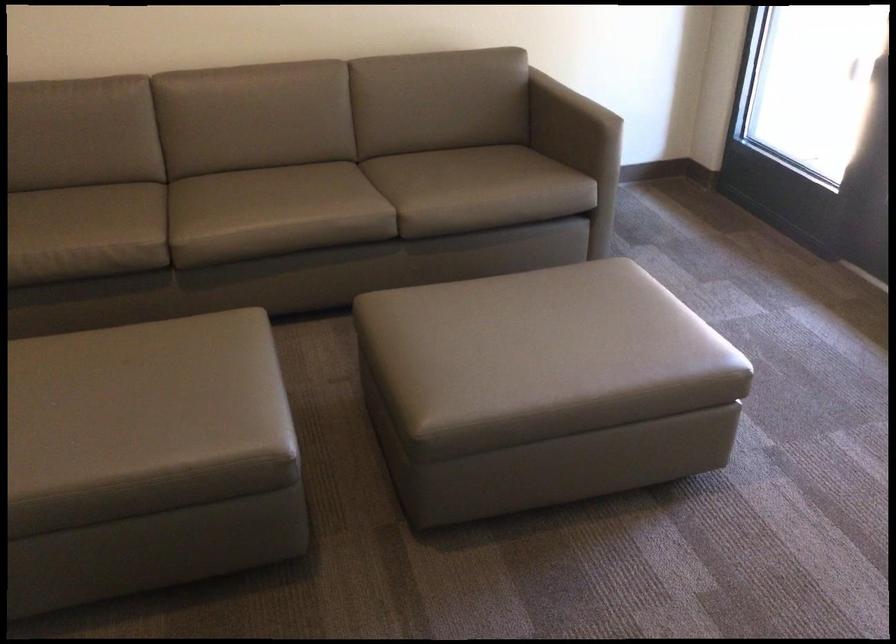
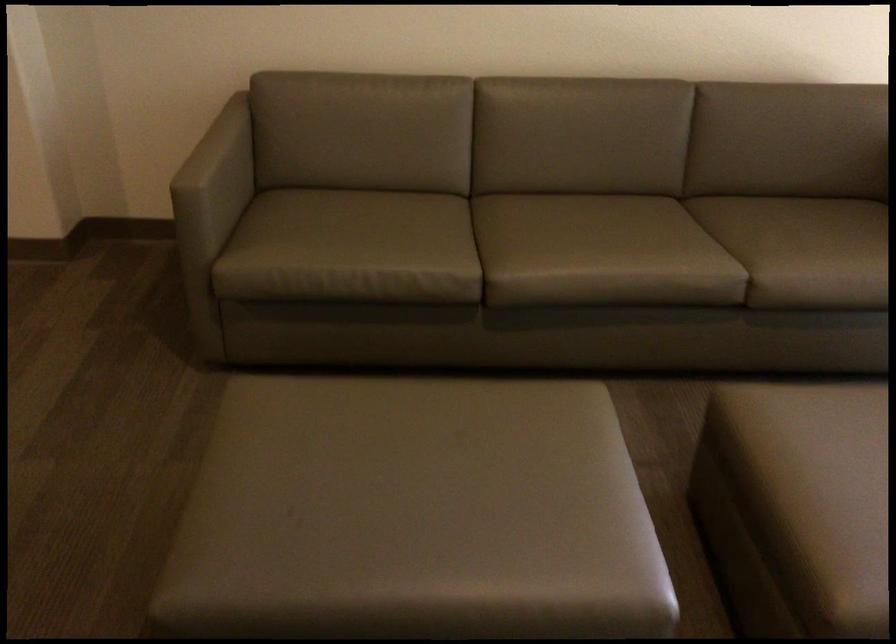
In the second image, find the point that corresponds to [458,182] in the first image.

(819, 251)